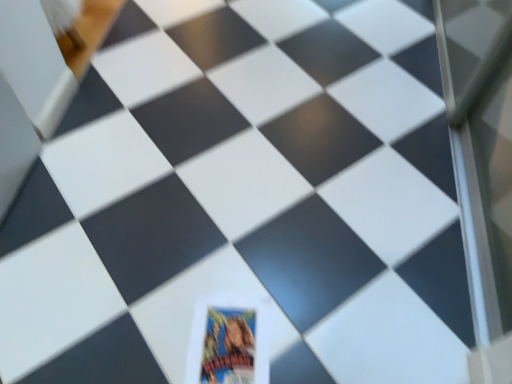
Locate an element on the screen. blank space to the left of colorful glossy comic book at center is located at coordinates [148, 324].